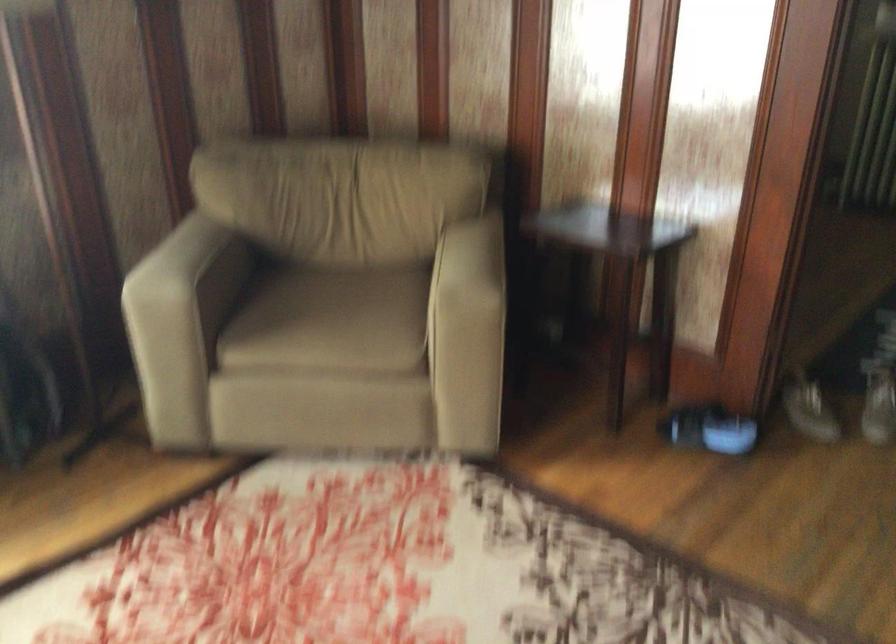
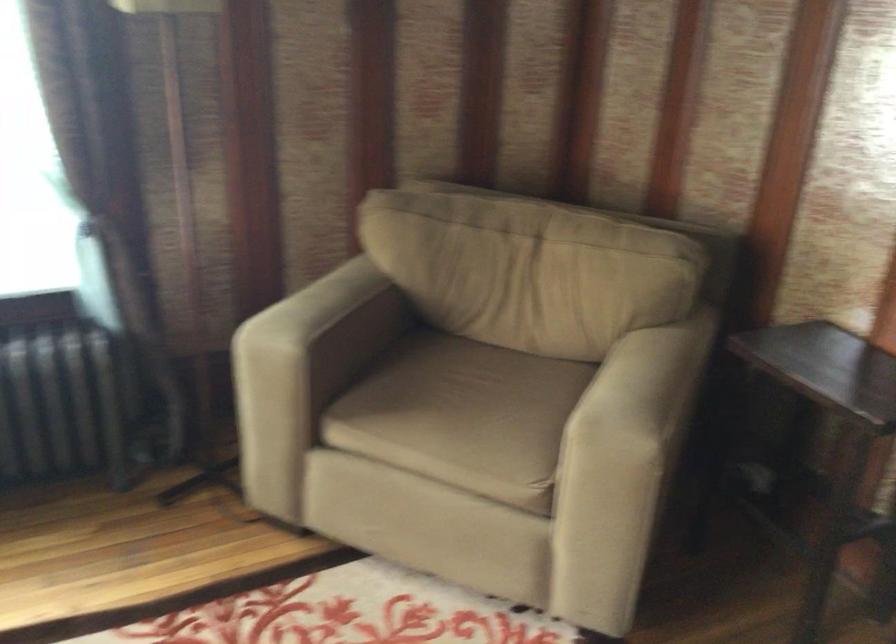
In the second image, find the point that corresponds to pixel 334 319 in the first image.

(458, 413)